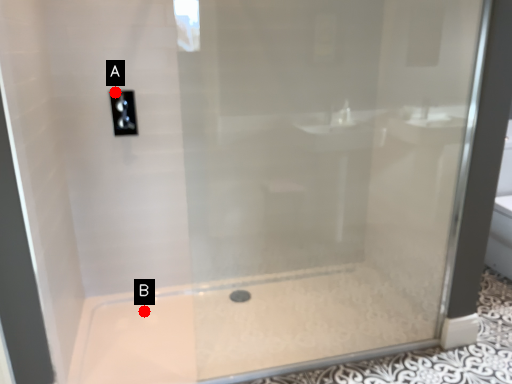
Question: Two points are circled on the image, labeled by A and B beside each circle. Which point is farther to the camera?

Choices:
 (A) A is further
 (B) B is further

Answer: (B)